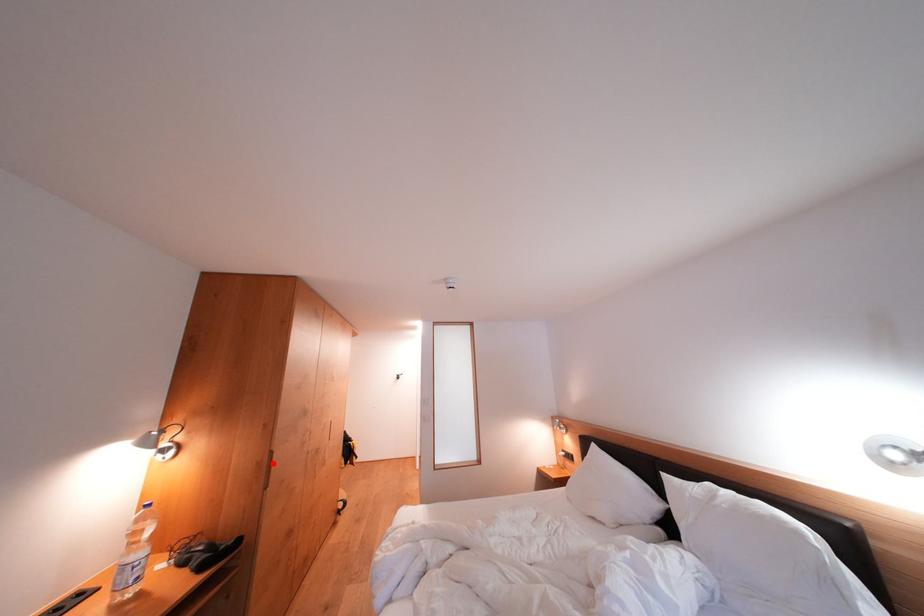
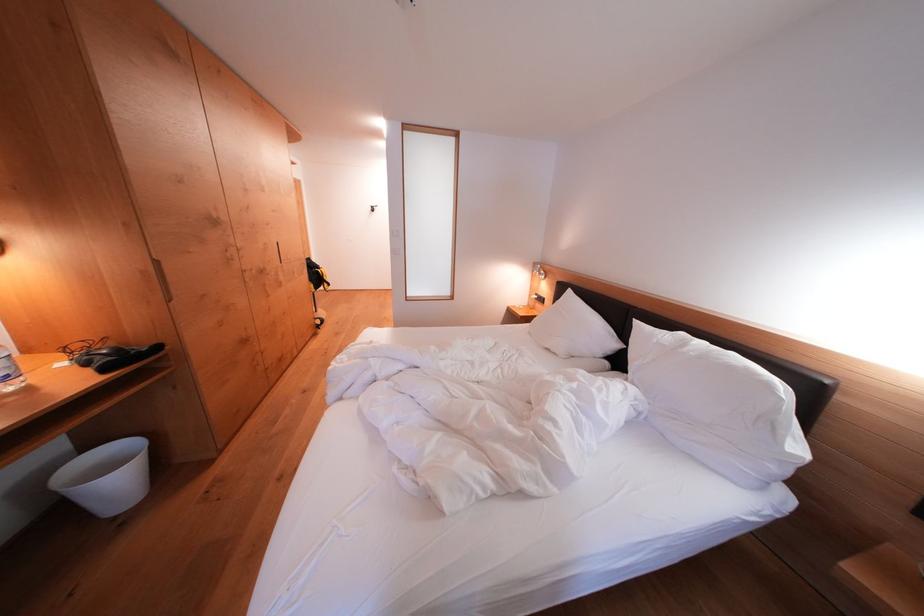
In the second image, find the point that corresponds to the highlighted location in the first image.

(159, 274)